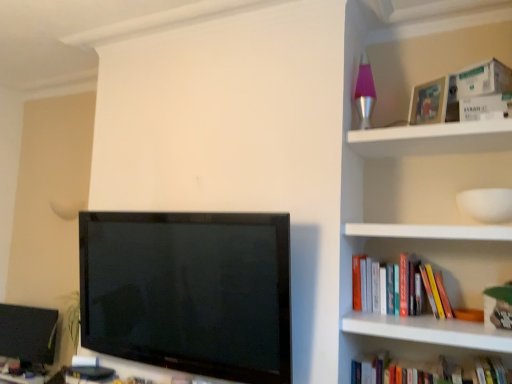
Question: From the image's perspective, is white cardboard box at upper right, the first paperback book positioned from the bottom, located above white cardboard box at upper right, marked as the first paperback book in a top-to-bottom arrangement?

Choices:
 (A) yes
 (B) no

Answer: (B)

Question: From the image's perspective, would you say white cardboard box at upper right, the 2th paperback book positioned from the top, is shown under white cardboard box at upper right, which is counted as the second paperback book, starting from the bottom?

Choices:
 (A) yes
 (B) no

Answer: (A)

Question: From a real-world perspective, is white cardboard box at upper right, the 2th paperback book positioned from the top, positioned under white cardboard box at upper right, marked as the first paperback book in a top-to-bottom arrangement, based on gravity?

Choices:
 (A) no
 (B) yes

Answer: (B)

Question: Considering the relative sizes of white cardboard box at upper right, the first paperback book positioned from the bottom, and white cardboard box at upper right, which is counted as the second paperback book, starting from the bottom, in the image provided, is white cardboard box at upper right, the first paperback book positioned from the bottom, thinner than white cardboard box at upper right, which is counted as the second paperback book, starting from the bottom,?

Choices:
 (A) no
 (B) yes

Answer: (B)

Question: Considering the relative sizes of white cardboard box at upper right, the first paperback book positioned from the bottom, and white cardboard box at upper right, which is counted as the second paperback book, starting from the bottom, in the image provided, is white cardboard box at upper right, the first paperback book positioned from the bottom, taller than white cardboard box at upper right, which is counted as the second paperback book, starting from the bottom,?

Choices:
 (A) no
 (B) yes

Answer: (A)

Question: Does white cardboard box at upper right, the first paperback book positioned from the bottom, have a lesser height compared to white cardboard box at upper right, marked as the first paperback book in a top-to-bottom arrangement?

Choices:
 (A) yes
 (B) no

Answer: (A)

Question: From a real-world perspective, is hardcover book at lower right, which is counted as the first book, starting from the bottom, under matte black monitor at lower left?

Choices:
 (A) yes
 (B) no

Answer: (B)

Question: Can you confirm if hardcover book at lower right, the 2th book viewed from the top, is wider than matte black monitor at lower left?

Choices:
 (A) no
 (B) yes

Answer: (B)

Question: Considering the relative sizes of hardcover book at lower right, which is counted as the first book, starting from the bottom, and matte black monitor at lower left in the image provided, is hardcover book at lower right, which is counted as the first book, starting from the bottom, smaller than matte black monitor at lower left?

Choices:
 (A) no
 (B) yes

Answer: (A)

Question: Is hardcover book at lower right, the 2th book viewed from the top, located outside matte black monitor at lower left?

Choices:
 (A) no
 (B) yes

Answer: (B)

Question: Is hardcover book at lower right, the 2th book viewed from the top, turned away from matte black monitor at lower left?

Choices:
 (A) yes
 (B) no

Answer: (B)

Question: Is the depth of hardcover book at lower right, the 2th book viewed from the top, less than that of matte black monitor at lower left?

Choices:
 (A) no
 (B) yes

Answer: (B)

Question: Could you tell me if hardcover book at right, the second book ordered from the bottom, is facing white cardboard box at upper right, which is counted as the second paperback book, starting from the bottom?

Choices:
 (A) no
 (B) yes

Answer: (A)